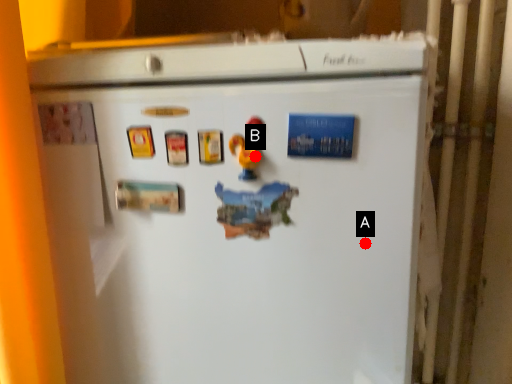
Question: Two points are circled on the image, labeled by A and B beside each circle. Among these points, which one is farthest from the camera?

Choices:
 (A) A is further
 (B) B is further

Answer: (A)